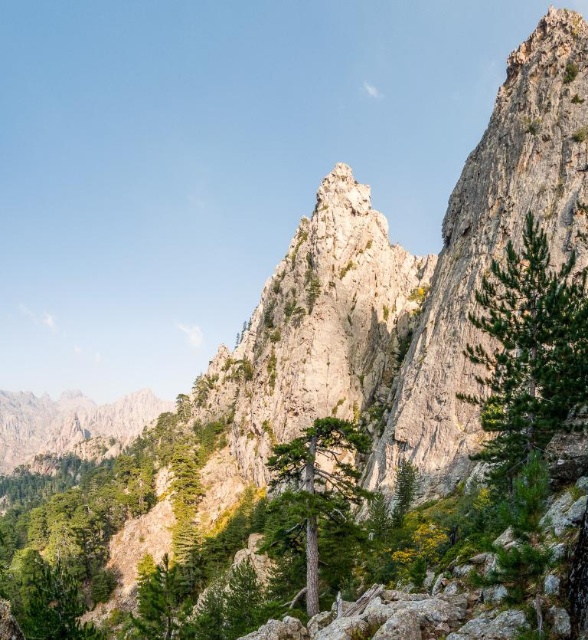
How far apart are green rough bark tree at right and green rough bark tree at center?

green rough bark tree at right and green rough bark tree at center are 54.12 feet apart from each other.

Can you confirm if green rough bark tree at right is bigger than green rough bark tree at center?

Actually, green rough bark tree at right might be smaller than green rough bark tree at center.

Which is behind, point (567, 340) or point (329, 476)?

Point (329, 476)

Where is `green rough bark tree at right`? green rough bark tree at right is located at coordinates tap(529, 353).